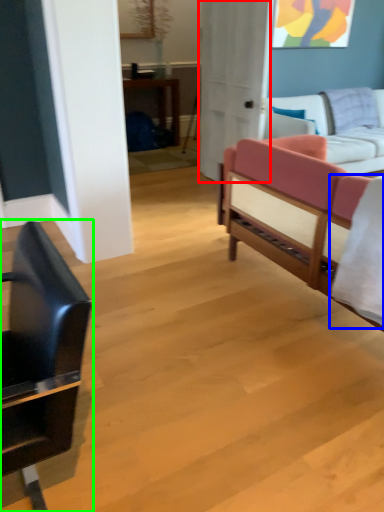
Question: Estimate the real-world distances between objects in this image. Which object is farther from glass door (highlighted by a red box), sheet (highlighted by a blue box) or chair (highlighted by a green box)?

Choices:
 (A) sheet
 (B) chair

Answer: (B)